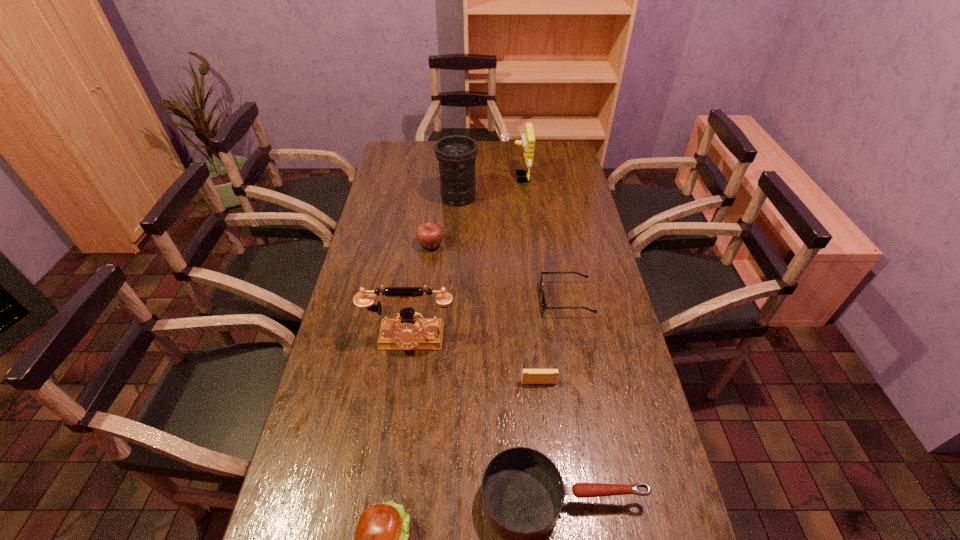
Locate an element on the screen. Image resolution: width=960 pixels, height=540 pixels. free region at the far right corner of the desktop is located at coordinates (564, 142).

Locate an element on the screen. unoccupied area between the telephoto lens and the apple is located at coordinates click(444, 221).

Identify the location of vacant area that lies between the sponge and the sunglasses. This screenshot has width=960, height=540. (543, 239).

At what (x,y) coordinates should I click in order to perform the action: click on blank region between the sixth farthest object and the third farthest object. Please return your answer as a coordinate pair (x, y). The height and width of the screenshot is (540, 960). Looking at the image, I should click on (485, 314).

Where is `free space between the sunglasses and the sixth nearest object`? Image resolution: width=960 pixels, height=540 pixels. free space between the sunglasses and the sixth nearest object is located at coordinates (498, 272).

Where is `vacant area that lies between the videotape and the telephone`? vacant area that lies between the videotape and the telephone is located at coordinates (474, 361).

Locate an element on the screen. empty space between the apple and the fifth nearest object is located at coordinates (498, 272).

Select which object is the fourth closest to the hamburger. Please provide its 2D coordinates. Your answer should be formatted as a tuple, i.e. [(x, y)], where the tuple contains the x and y coordinates of a point satisfying the conditions above.

[(544, 305)]

This screenshot has width=960, height=540. What are the coordinates of `object that is the third closest to the sponge` in the screenshot? It's located at (544, 305).

Find the location of `free spot that satisfies the following two spatial constraints: 1. on the front lenses of the sunglasses; 2. at the front of the sixth farthest object with spools`. free spot that satisfies the following two spatial constraints: 1. on the front lenses of the sunglasses; 2. at the front of the sixth farthest object with spools is located at coordinates (582, 382).